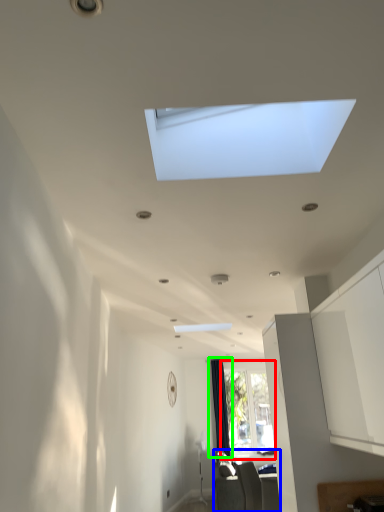
Question: Considering the real-world distances, which object is farthest from window (highlighted by a red box)? furniture (highlighted by a blue box) or curtain (highlighted by a green box)?

Choices:
 (A) furniture
 (B) curtain

Answer: (A)